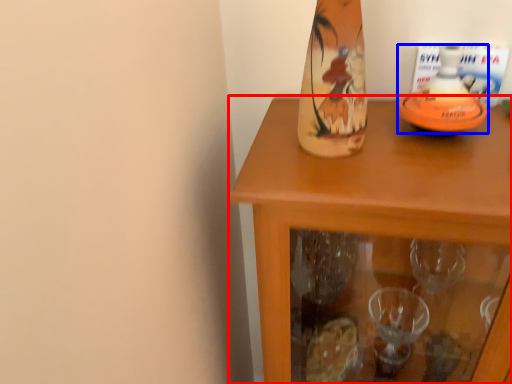
Question: Which object appears farthest to the camera in this image, table (highlighted by a red box) or bottle (highlighted by a blue box)?

Choices:
 (A) table
 (B) bottle

Answer: (B)